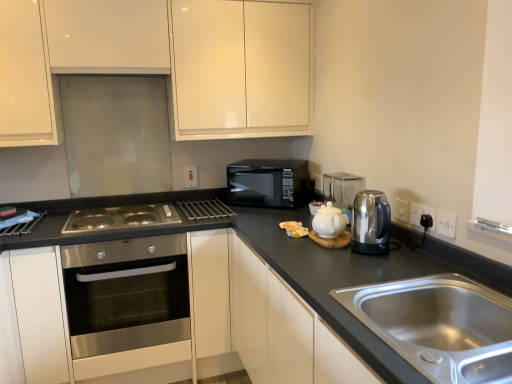
Question: From a real-world perspective, is stainless steel oven at center-left positioned under metallic silver rack at center, placed as the first appliance when sorted from left to right, based on gravity?

Choices:
 (A) no
 (B) yes

Answer: (B)

Question: Is stainless steel oven at center-left to the right of metallic silver rack at center, which is the first appliance in back-to-front order, from the viewer's perspective?

Choices:
 (A) no
 (B) yes

Answer: (A)

Question: Does stainless steel oven at center-left touch metallic silver rack at center, the 3th appliance from the front?

Choices:
 (A) yes
 (B) no

Answer: (B)

Question: Is stainless steel oven at center-left outside metallic silver rack at center, the 3th appliance from the front?

Choices:
 (A) yes
 (B) no

Answer: (A)

Question: From a real-world perspective, does stainless steel oven at center-left stand above metallic silver rack at center, which is the 3th appliance from right to left?

Choices:
 (A) no
 (B) yes

Answer: (A)

Question: Would you say white glossy tea pot at center is to the left or to the right of satin metallic kettle at right, the 3th appliance when ordered from back to front, in the picture?

Choices:
 (A) right
 (B) left

Answer: (B)

Question: From a real-world perspective, is white glossy tea pot at center above or below satin metallic kettle at right, the first appliance positioned from the right?

Choices:
 (A) above
 (B) below

Answer: (B)

Question: From their relative heights in the image, would you say white glossy tea pot at center is taller or shorter than satin metallic kettle at right, marked as the first appliance in a front-to-back arrangement?

Choices:
 (A) short
 (B) tall

Answer: (A)

Question: In terms of size, does white glossy tea pot at center appear bigger or smaller than satin metallic kettle at right, the first appliance positioned from the right?

Choices:
 (A) small
 (B) big

Answer: (A)

Question: In terms of size, does white plastic electric outlet at right, placed as the 1th electric outlet when sorted from front to back, appear bigger or smaller than stainless steel oven at lower left, arranged as the 1th cabinetry when ordered from the bottom?

Choices:
 (A) big
 (B) small

Answer: (B)

Question: Is white plastic electric outlet at right, marked as the 4th electric outlet in a back-to-front arrangement, spatially inside stainless steel oven at lower left, arranged as the 2th cabinetry when viewed from the top, or outside of it?

Choices:
 (A) outside
 (B) inside

Answer: (A)

Question: Relative to stainless steel oven at lower left, arranged as the 2th cabinetry when viewed from the top, is white plastic electric outlet at right, placed as the 1th electric outlet when sorted from front to back, in front or behind?

Choices:
 (A) behind
 (B) front

Answer: (B)

Question: Visually, is white plastic electric outlet at right, positioned as the fourth electric outlet in left-to-right order, positioned to the left or to the right of stainless steel oven at lower left, arranged as the 1th cabinetry when ordered from the bottom?

Choices:
 (A) right
 (B) left

Answer: (A)

Question: Is white plastic electric outlet at upper center, positioned as the second electric outlet in left-to-right order, taller or shorter than metallic silver rack at center, which is the first appliance in back-to-front order?

Choices:
 (A) tall
 (B) short

Answer: (A)

Question: Is white plastic electric outlet at upper center, positioned as the second electric outlet in left-to-right order, to the left or to the right of metallic silver rack at center, which is the 3th appliance from right to left, in the image?

Choices:
 (A) left
 (B) right

Answer: (B)